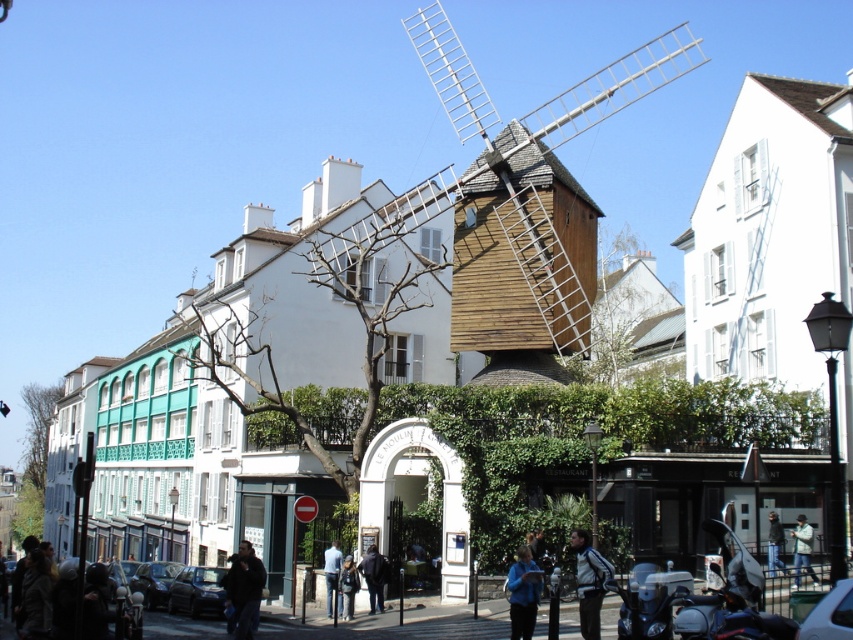
Question: Can you confirm if dark blue jacket at lower left is thinner than blue fabric jacket at lower center?

Choices:
 (A) yes
 (B) no

Answer: (B)

Question: Which point is closer to the camera?

Choices:
 (A) white jacket at center
 (B) dark blue jeans at center

Answer: (A)

Question: Which point is farther to the camera?

Choices:
 (A) shiny black motorcycle at lower right
 (B) blue shirt at center

Answer: (B)

Question: Does white jacket at center have a larger size compared to denim jacket at lower right?

Choices:
 (A) yes
 (B) no

Answer: (A)

Question: Can you confirm if metallic blue motorcycle at center is smaller than denim jacket at lower center?

Choices:
 (A) no
 (B) yes

Answer: (A)

Question: Among these objects, which one is farthest from the camera?

Choices:
 (A) wooden windmill at center
 (B) denim jacket at lower center
 (C) dark blue jacket at lower left

Answer: (A)